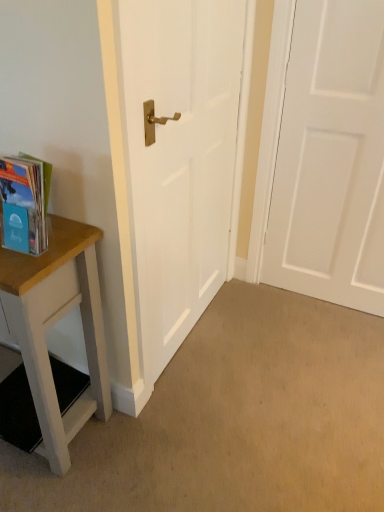
Question: Does white matte door at center, which is the 1th door in left-to-right order, appear on the right side of white matte door at right, which appears as the second door when viewed from the left?

Choices:
 (A) no
 (B) yes

Answer: (A)

Question: Considering the relative sizes of white matte door at center, which appears as the 2th door when viewed from the right, and white matte door at right, which is the 1th door from right to left, in the image provided, is white matte door at center, which appears as the 2th door when viewed from the right, taller than white matte door at right, which is the 1th door from right to left,?

Choices:
 (A) no
 (B) yes

Answer: (A)

Question: Can you confirm if white matte door at center, which is the 1th door in left-to-right order, is smaller than white matte door at right, which appears as the second door when viewed from the left?

Choices:
 (A) no
 (B) yes

Answer: (B)

Question: Does white matte door at center, which is the 1th door in left-to-right order, lie behind white matte door at right, which is the 1th door from right to left?

Choices:
 (A) no
 (B) yes

Answer: (A)

Question: Is white matte door at center, which appears as the 2th door when viewed from the right, next to white matte door at right, which is the 1th door from right to left, and touching it?

Choices:
 (A) yes
 (B) no

Answer: (B)

Question: Would you say wooden table at left is inside or outside translucent plastic book at left?

Choices:
 (A) outside
 (B) inside

Answer: (A)

Question: Considering the relative positions of wooden table at left and translucent plastic book at left in the image provided, is wooden table at left to the left or to the right of translucent plastic book at left?

Choices:
 (A) left
 (B) right

Answer: (A)

Question: Relative to translucent plastic book at left, is wooden table at left in front or behind?

Choices:
 (A) behind
 (B) front

Answer: (A)

Question: In terms of size, does wooden table at left appear bigger or smaller than translucent plastic book at left?

Choices:
 (A) small
 (B) big

Answer: (B)

Question: Considering the positions of wooden table at left and white matte door at right, which is the 1th door from right to left, in the image, is wooden table at left bigger or smaller than white matte door at right, which is the 1th door from right to left,?

Choices:
 (A) big
 (B) small

Answer: (A)

Question: In the image, is wooden table at left positioned in front of or behind white matte door at right, which is the 1th door from right to left?

Choices:
 (A) behind
 (B) front

Answer: (B)

Question: From a real-world perspective, is wooden table at left physically located above or below white matte door at right, which appears as the second door when viewed from the left?

Choices:
 (A) above
 (B) below

Answer: (B)

Question: In terms of width, does wooden table at left look wider or thinner when compared to white matte door at right, which is the 1th door from right to left?

Choices:
 (A) thin
 (B) wide

Answer: (B)

Question: From their relative heights in the image, would you say translucent plastic book at left is taller or shorter than white matte door at center, which is the 1th door in left-to-right order?

Choices:
 (A) short
 (B) tall

Answer: (A)

Question: From the image's perspective, is translucent plastic book at left positioned above or below white matte door at center, which appears as the 2th door when viewed from the right?

Choices:
 (A) below
 (B) above

Answer: (A)